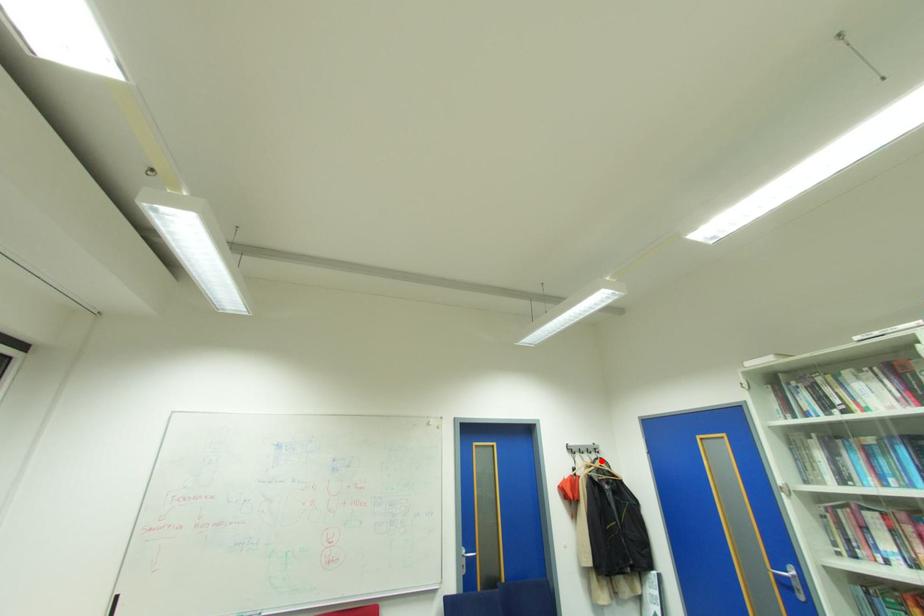
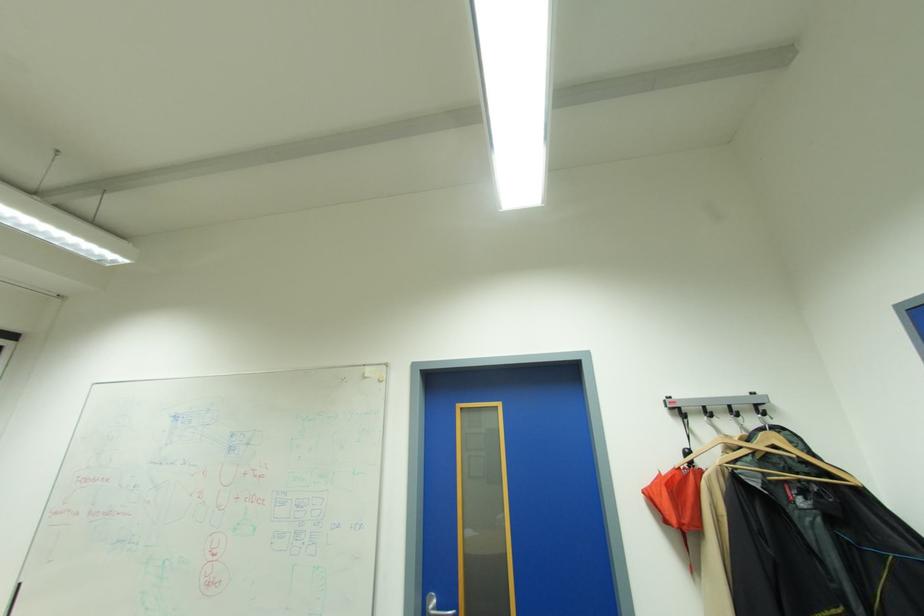
Question: I am providing you with two images of the same scene from different viewpoints. A red point is shown in image1. For the corresponding object point in image2, is it positioned nearer or farther from the camera?

Choices:
 (A) Nearer
 (B) Farther

Answer: (A)